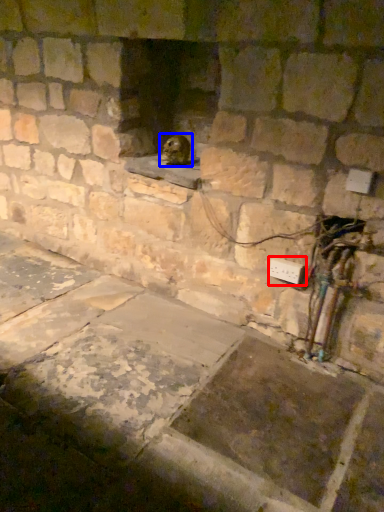
Question: Which of the following is the closest to the observer, electric outlet (highlighted by a red box) or animal (highlighted by a blue box)?

Choices:
 (A) electric outlet
 (B) animal

Answer: (A)